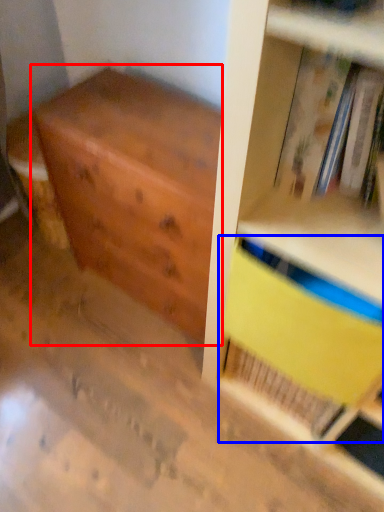
Question: Which object appears farthest to the camera in this image, chest of drawers (highlighted by a red box) or paperback book (highlighted by a blue box)?

Choices:
 (A) chest of drawers
 (B) paperback book

Answer: (A)